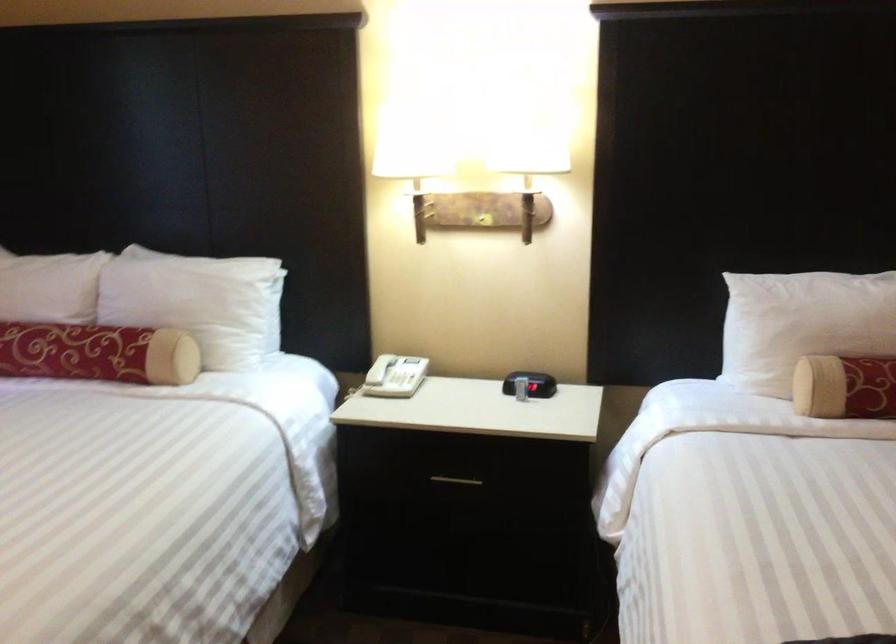
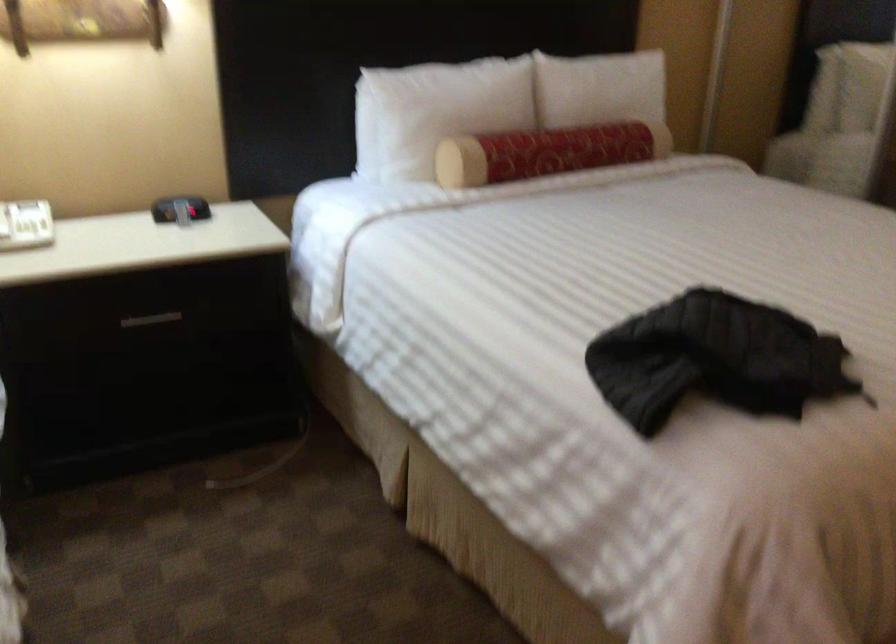
In the second image, find the point that corresponds to point 455,478 in the first image.

(151, 319)